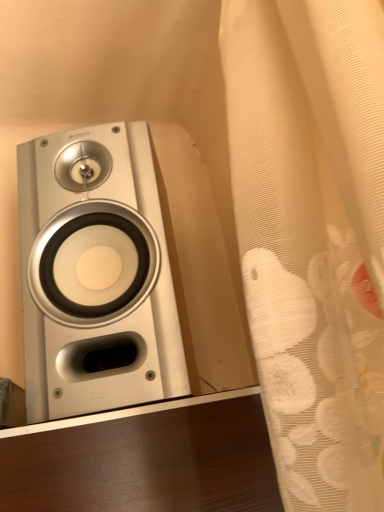
Question: Would you say white sheer curtain at right is outside silver metallic speaker at left?

Choices:
 (A) no
 (B) yes

Answer: (B)

Question: Can you confirm if white sheer curtain at right is bigger than silver metallic speaker at left?

Choices:
 (A) yes
 (B) no

Answer: (B)

Question: Considering the relative sizes of white sheer curtain at right and silver metallic speaker at left in the image provided, is white sheer curtain at right thinner than silver metallic speaker at left?

Choices:
 (A) no
 (B) yes

Answer: (B)

Question: Is white sheer curtain at right at the left side of silver metallic speaker at left?

Choices:
 (A) no
 (B) yes

Answer: (A)

Question: Would you say silver metallic speaker at left is part of white sheer curtain at right's contents?

Choices:
 (A) yes
 (B) no

Answer: (B)

Question: Considering the relative sizes of white sheer curtain at right and silver metallic speaker at left in the image provided, is white sheer curtain at right wider than silver metallic speaker at left?

Choices:
 (A) no
 (B) yes

Answer: (A)

Question: Is silver metallic speaker at left positioned beyond the bounds of white sheer curtain at right?

Choices:
 (A) no
 (B) yes

Answer: (B)

Question: Does silver metallic speaker at left appear on the right side of white sheer curtain at right?

Choices:
 (A) yes
 (B) no

Answer: (B)

Question: Does silver metallic speaker at left have a greater width compared to white sheer curtain at right?

Choices:
 (A) yes
 (B) no

Answer: (A)

Question: From a real-world perspective, does silver metallic speaker at left stand above white sheer curtain at right?

Choices:
 (A) yes
 (B) no

Answer: (A)

Question: Is silver metallic speaker at left looking in the opposite direction of white sheer curtain at right?

Choices:
 (A) no
 (B) yes

Answer: (A)

Question: From a real-world perspective, is silver metallic speaker at left below white sheer curtain at right?

Choices:
 (A) no
 (B) yes

Answer: (A)

Question: Looking at their shapes, would you say white sheer curtain at right is wider or thinner than silver metallic speaker at left?

Choices:
 (A) wide
 (B) thin

Answer: (B)